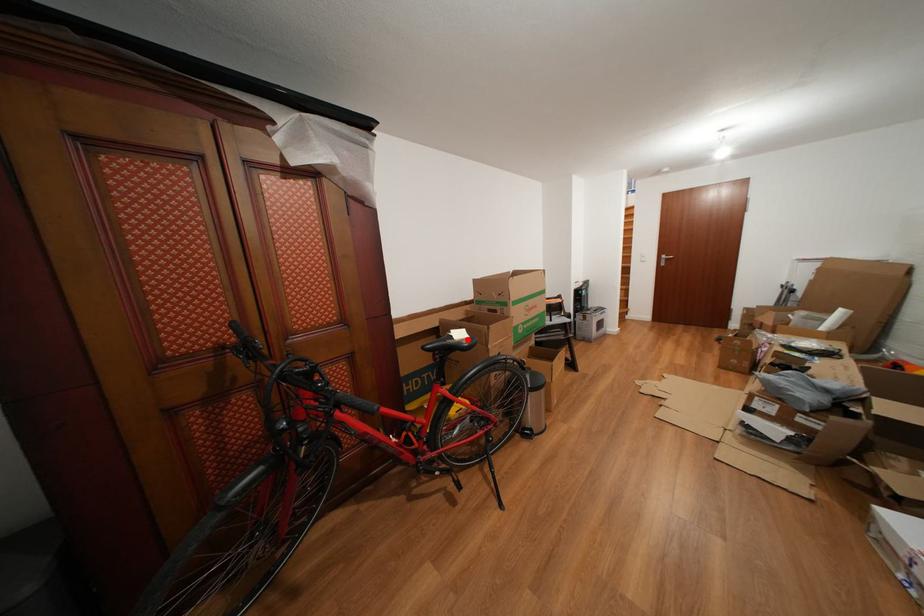
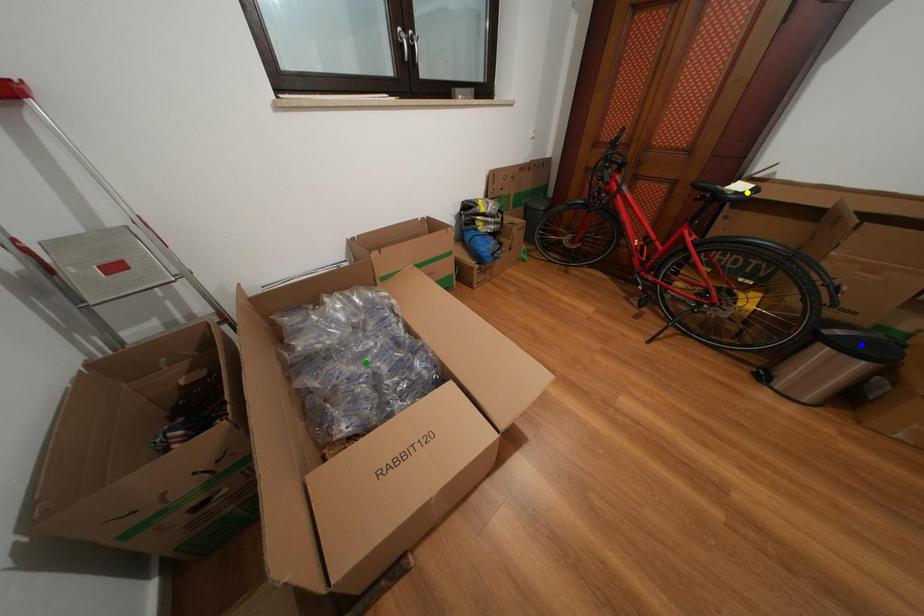
Question: I am providing you with two images of the same scene from different viewpoints. A red point is marked on the first image. You are given multiple points on the second image. Which mark in image 2 goes with the point in image 1?

Choices:
 (A) yellow point
 (B) green point
 (C) blue point

Answer: (A)